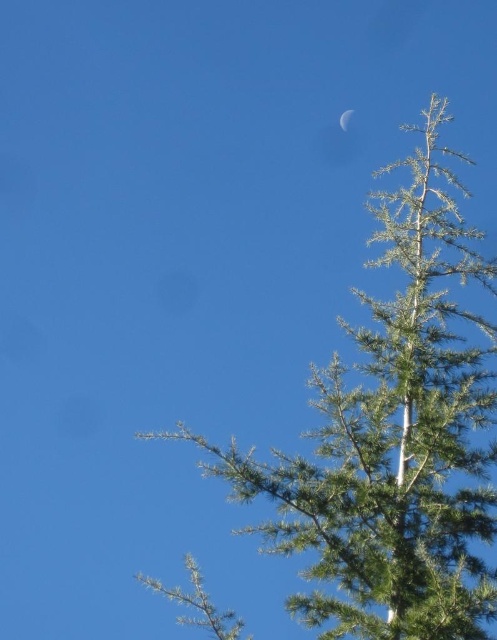
What do you see at coordinates (395, 440) in the screenshot? I see `green needle-like tree at upper right` at bounding box center [395, 440].

Can you confirm if green needle-like tree at upper right is taller than silvery reflective crescent at upper center?

Yes.

Describe the element at coordinates (395, 440) in the screenshot. I see `green needle-like tree at upper right` at that location.

Locate an element on the screen. The image size is (497, 640). green needle-like tree at upper right is located at coordinates (395, 440).